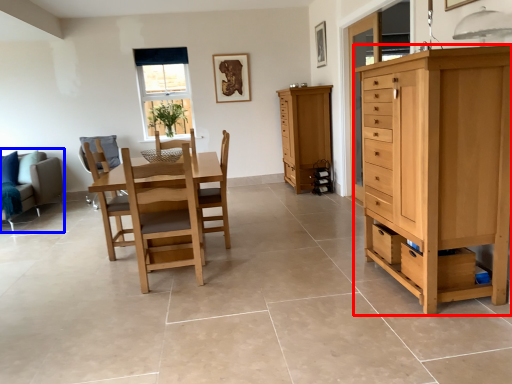
Question: Which object is closer to the camera taking this photo, chest of drawers (highlighted by a red box) or studio couch (highlighted by a blue box)?

Choices:
 (A) chest of drawers
 (B) studio couch

Answer: (A)